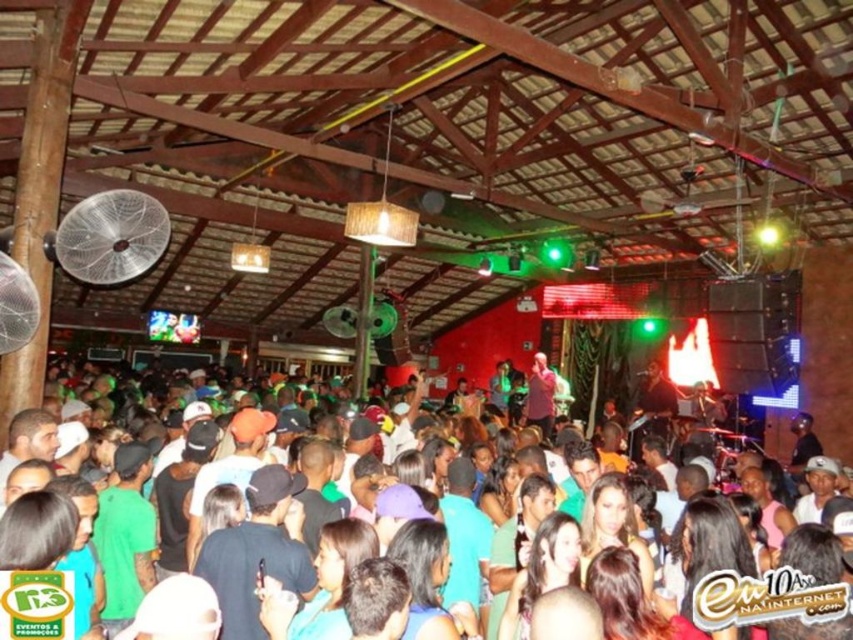
Who is more distant from viewer, [99,221] or [32,324]?

Positioned behind is point [99,221].

Which of these two, white plastic fan at upper left or white mesh fan at left, stands shorter?

white mesh fan at left

Measure the distance between white plastic fan at upper left and camera.

A distance of 15.71 feet exists between white plastic fan at upper left and camera.

The width and height of the screenshot is (853, 640). Find the location of `white plastic fan at upper left`. white plastic fan at upper left is located at coordinates tap(112, 236).

Does matte black crowd at center appear on the right side of white mesh fan at left?

Indeed, matte black crowd at center is positioned on the right side of white mesh fan at left.

Can you confirm if matte black crowd at center is shorter than white mesh fan at left?

In fact, matte black crowd at center may be taller than white mesh fan at left.

Locate an element on the screen. The width and height of the screenshot is (853, 640). matte black crowd at center is located at coordinates (171, 522).

Between matte black crowd at center and white plastic fan at upper left, which one has more height?

With more height is matte black crowd at center.

Which is more to the left, matte black crowd at center or white plastic fan at upper left?

From the viewer's perspective, white plastic fan at upper left appears more on the left side.

You are a GUI agent. You are given a task and a screenshot of the screen. Output one action in this format:
    pyautogui.click(x=<x>, y=<y>)
    Task: Click on the matte black crowd at center
    
    Given the screenshot: What is the action you would take?
    tap(171, 522)